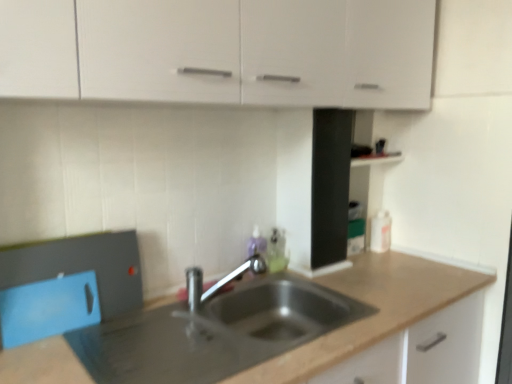
You are a GUI agent. You are given a task and a screenshot of the screen. Output one action in this format:
    pyautogui.click(x=<x>, y=<y>)
    Task: Click on the polished chrome tap at center
    This screenshot has height=384, width=512.
    Given the screenshot: What is the action you would take?
    pyautogui.click(x=212, y=294)

Where is `polished chrome tap at center`? Image resolution: width=512 pixels, height=384 pixels. polished chrome tap at center is located at coordinates (212, 294).

From a real-world perspective, is metallic gray countertop at center on polished chrome tap at center?

No, from a real-world perspective, metallic gray countertop at center is not over polished chrome tap at center

Is metallic gray countertop at center not near polished chrome tap at center?

No, metallic gray countertop at center is in close proximity to polished chrome tap at center.

From the image's perspective, which is below, metallic gray countertop at center or polished chrome tap at center?

metallic gray countertop at center is shown below in the image.

Is metallic gray countertop at center outside of polished chrome tap at center?

Yes.

Looking at their sizes, would you say metallic gray countertop at center is wider or thinner than white matte cabinet at upper center?

Considering their sizes, metallic gray countertop at center looks broader than white matte cabinet at upper center.

Is point (40, 357) closer or farther from the camera than point (211, 12)?

Point (40, 357) appears to be farther away from the viewer than point (211, 12).

Considering the positions of objects metallic gray countertop at center and white matte cabinet at upper center in the image provided, who is more to the left, metallic gray countertop at center or white matte cabinet at upper center?

From the viewer's perspective, metallic gray countertop at center appears more on the left side.

Is polished chrome tap at center wider than metallic gray countertop at center?

No.

Does polished chrome tap at center contain metallic gray countertop at center?

No, polished chrome tap at center does not contain metallic gray countertop at center.

From a real-world perspective, is polished chrome tap at center beneath metallic gray countertop at center?

No, from a real-world perspective, polished chrome tap at center is not under metallic gray countertop at center.

Does polished chrome tap at center have a smaller size compared to metallic gray countertop at center?

Yes, polished chrome tap at center is smaller than metallic gray countertop at center.

From the image's perspective, which is above, polished chrome tap at center or white matte cabinet at upper center?

From the image's view, white matte cabinet at upper center is above.

Identify the location of tap below the white matte cabinet at upper center (from a real-world perspective). (212, 294).

Considering the relative sizes of polished chrome tap at center and white matte cabinet at upper center in the image provided, is polished chrome tap at center smaller than white matte cabinet at upper center?

Correct, polished chrome tap at center occupies less space than white matte cabinet at upper center.

Considering the points (213, 285) and (408, 54), which point is in front, point (213, 285) or point (408, 54)?

The point (213, 285) is more forward.

Is white matte cabinet at upper center oriented away from metallic gray countertop at center?

No, white matte cabinet at upper center is not facing the opposite direction of metallic gray countertop at center.

Looking at this image, from the image's perspective, is white matte cabinet at upper center above metallic gray countertop at center?

Indeed, from the image's perspective, white matte cabinet at upper center is shown above metallic gray countertop at center.

Does point (326, 98) come closer to viewer compared to point (369, 342)?

No, (326, 98) is behind (369, 342).

Considering the sizes of objects white matte cabinet at upper center and polished chrome tap at center in the image provided, who is bigger, white matte cabinet at upper center or polished chrome tap at center?

Bigger between the two is white matte cabinet at upper center.

Is white matte cabinet at upper center taller than polished chrome tap at center?

Indeed, white matte cabinet at upper center has a greater height compared to polished chrome tap at center.

At what (x,y) coordinates should I click in order to perform the action: click on tap behind the white matte cabinet at upper center. Please return your answer as a coordinate pair (x, y). The image size is (512, 384). Looking at the image, I should click on (212, 294).

Consider the image. Between white matte cabinet at upper center and polished chrome tap at center, which one is positioned in front?

white matte cabinet at upper center.

You are a GUI agent. You are given a task and a screenshot of the screen. Output one action in this format:
    pyautogui.click(x=<x>, y=<y>)
    Task: Click on the tap behind the metallic gray countertop at center
    This screenshot has width=512, height=384.
    Given the screenshot: What is the action you would take?
    pyautogui.click(x=212, y=294)

Locate an element on the screen. The width and height of the screenshot is (512, 384). countertop that is below the white matte cabinet at upper center (from the image's perspective) is located at coordinates (373, 305).

Estimate the real-world distances between objects in this image. Which object is further from polished chrome tap at center, white matte cabinet at upper center or metallic gray countertop at center?

The object further to polished chrome tap at center is white matte cabinet at upper center.

From the image, which object appears to be farther from white matte cabinet at upper center, metallic gray countertop at center or polished chrome tap at center?

metallic gray countertop at center.

From the image, which object appears to be nearer to white matte cabinet at upper center, polished chrome tap at center or metallic gray countertop at center?

The object closer to white matte cabinet at upper center is polished chrome tap at center.

Estimate the real-world distances between objects in this image. Which object is further from metallic gray countertop at center, white matte cabinet at upper center or polished chrome tap at center?

Among the two, white matte cabinet at upper center is located further to metallic gray countertop at center.

Considering their positions, is metallic gray countertop at center positioned further to polished chrome tap at center than white matte cabinet at upper center?

The object further to polished chrome tap at center is white matte cabinet at upper center.

Estimate the real-world distances between objects in this image. Which object is closer to metallic gray countertop at center, polished chrome tap at center or white matte cabinet at upper center?

polished chrome tap at center lies closer to metallic gray countertop at center than the other object.

Locate an element on the screen. tap between white matte cabinet at upper center and metallic gray countertop at center in the vertical direction is located at coordinates (212, 294).